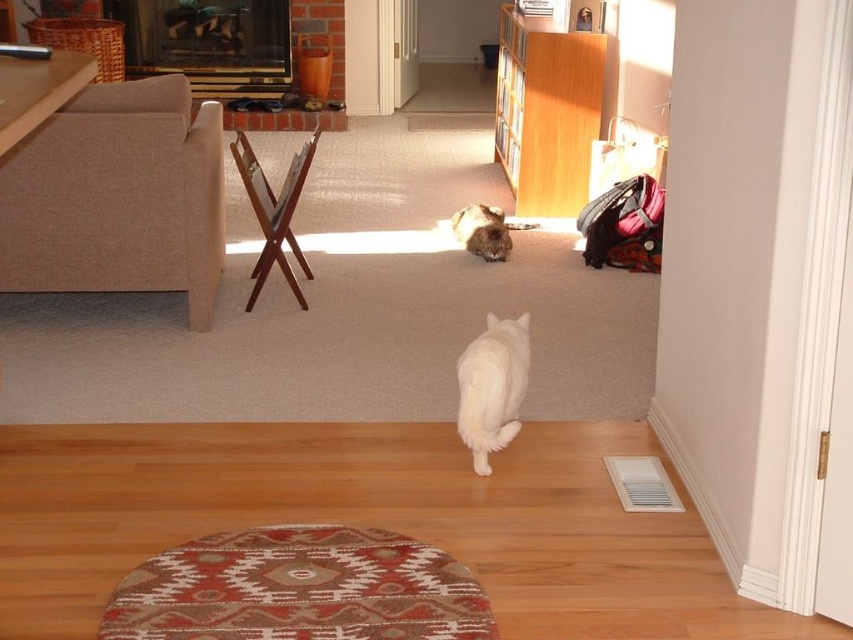
You are standing in the living room and see two points marked in the scene. Which point is closer to you, point (500, 141) or point (485, 228)?

Point (500, 141) is closer to you because it is further to the camera than point (485, 228).

You are standing in the living room and want to place a small toy exactly where the white fluffy cat at center is currently located. According to the coordinates given, where should you place the toy?

You should place the toy at the coordinates point (492,387) where the white fluffy cat at center is located.

You are a delivery person who needs to place a package that is 3 meters long between the wooden bookshelf at upper center and the white fluffy cat at center. Can you fit the package between them without moving either object?

The distance between the wooden bookshelf at upper center and the white fluffy cat at center is 2.67 meters. Since the package is 3 meters long, it is longer than the available space, so it cannot be placed between them without moving either object.